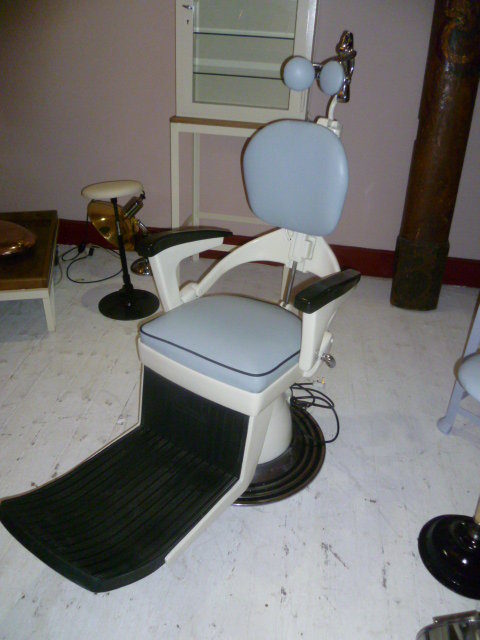
Where is `power cable`? This screenshot has height=640, width=480. power cable is located at coordinates (312, 399), (79, 253).